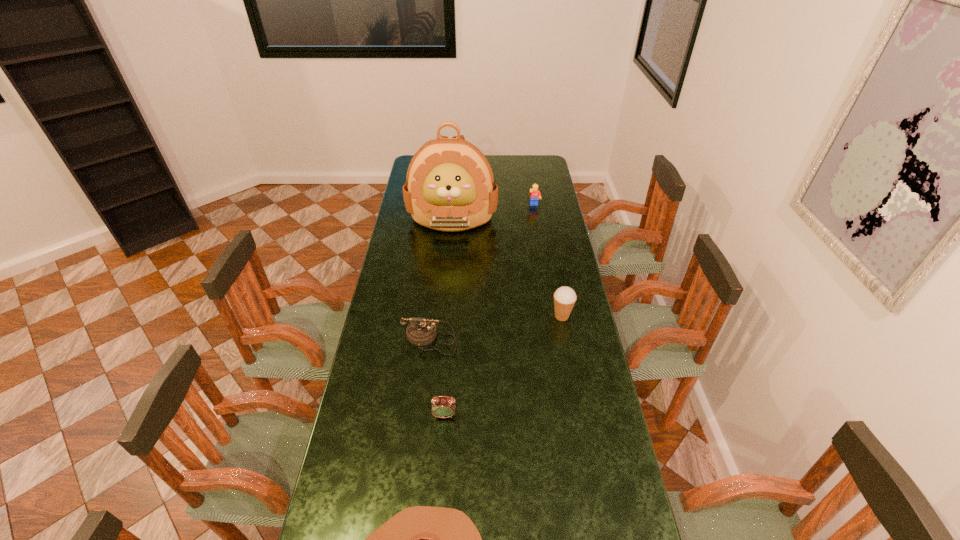
I want to click on backpack present at the left edge, so click(450, 186).

Image resolution: width=960 pixels, height=540 pixels. What are the coordinates of `telephone that is at the left edge` in the screenshot? It's located at (421, 331).

Identify the location of icecream present at the right edge. The height and width of the screenshot is (540, 960). (565, 297).

Locate an element on the screen. Image resolution: width=960 pixels, height=540 pixels. Lego positioned at the right edge is located at coordinates (535, 194).

The image size is (960, 540). Identify the location of vacant space at the far edge of the desktop. (517, 158).

This screenshot has width=960, height=540. What are the coordinates of `free space at the left edge` in the screenshot? It's located at (384, 447).

This screenshot has width=960, height=540. I want to click on vacant space at the right edge of the desktop, so coord(548,249).

You are a GUI agent. You are given a task and a screenshot of the screen. Output one action in this format:
    pyautogui.click(x=<x>, y=<y>)
    Task: Click on the vacant space at the far right corner of the desktop
    Image resolution: width=960 pixels, height=540 pixels.
    Given the screenshot: What is the action you would take?
    pyautogui.click(x=524, y=165)

In order to click on vacant area between the icecream and the backpack in this screenshot , I will do pyautogui.click(x=507, y=267).

The width and height of the screenshot is (960, 540). Find the location of `free space between the icecream and the tallest object`. free space between the icecream and the tallest object is located at coordinates (507, 267).